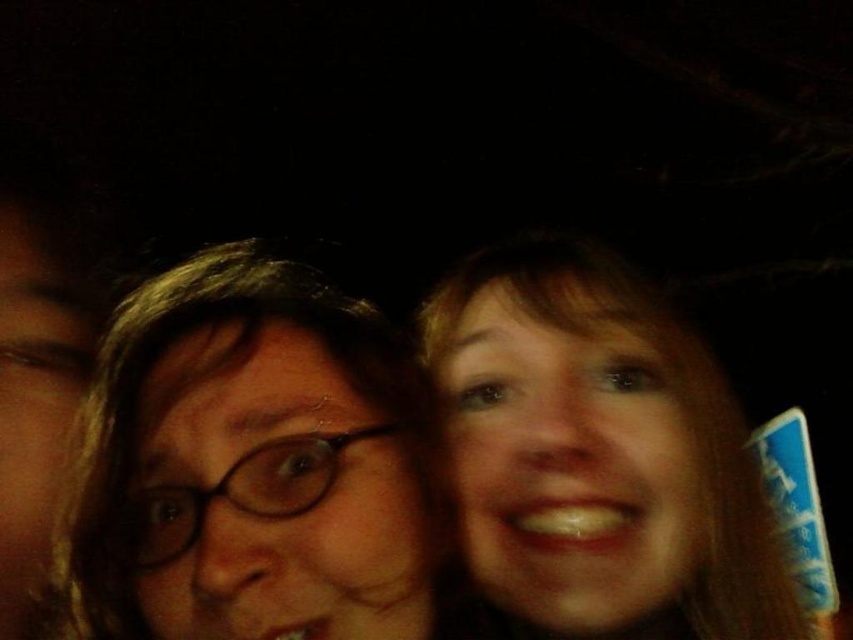
Question: Does matte brown hair at center appear under smooth skin face at right?

Choices:
 (A) no
 (B) yes

Answer: (A)

Question: Which point appears closest to the camera in this image?

Choices:
 (A) (509, 486)
 (B) (440, 568)

Answer: (A)

Question: Which object appears closest to the camera in this image?

Choices:
 (A) matte brown hair at center
 (B) smooth skin face at right

Answer: (A)

Question: Which point is farther from the camera taking this photo?

Choices:
 (A) (297, 262)
 (B) (740, 454)

Answer: (A)

Question: Is matte brown hair at center thinner than smooth skin face at right?

Choices:
 (A) yes
 (B) no

Answer: (A)

Question: Can you confirm if matte brown hair at center is positioned to the left of smooth skin face at right?

Choices:
 (A) no
 (B) yes

Answer: (B)